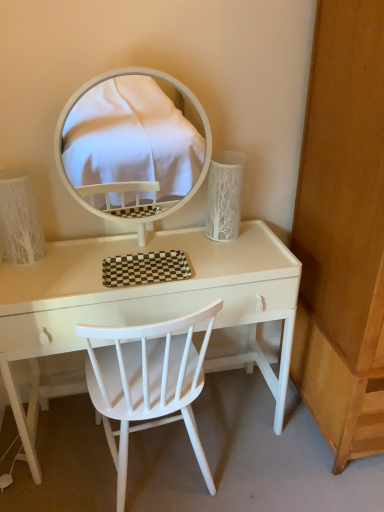
This screenshot has height=512, width=384. Find the location of `free space in front of white textured vase at right, which is the first table lamp from right to left`. free space in front of white textured vase at right, which is the first table lamp from right to left is located at coordinates (235, 261).